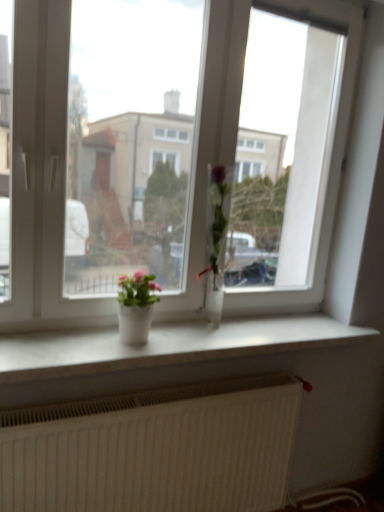
This screenshot has height=512, width=384. I want to click on white marble window sill at center, so click(166, 346).

Find the location of a particular element. This screenshot has width=384, height=512. clear glass vase at center, marked as the first houseplant in a right-to-left arrangement is located at coordinates (216, 239).

Find the location of `white textured radiator at lower center`. white textured radiator at lower center is located at coordinates (154, 449).

Considering the relative sizes of white textured radiator at lower center and white marble window sill at center in the image provided, is white textured radiator at lower center wider than white marble window sill at center?

In fact, white textured radiator at lower center might be narrower than white marble window sill at center.

Locate an element on the screen. Image resolution: width=384 pixels, height=512 pixels. radiator on the left of the white marble window sill at center is located at coordinates click(x=154, y=449).

Consider the image. Is white textured radiator at lower center taller or shorter than white marble window sill at center?

In the image, white textured radiator at lower center appears to be taller than white marble window sill at center.

Could you tell me if white textured radiator at lower center is facing white marble window sill at center?

No, white textured radiator at lower center does not turn towards white marble window sill at center.

Consider the image. From the image's perspective, is clear glass vase at center, marked as the first houseplant in a right-to-left arrangement, over white marble window sill at center?

Yes, from the image's perspective, clear glass vase at center, marked as the first houseplant in a right-to-left arrangement, is over white marble window sill at center.

Which is more distant, (213,222) or (262,331)?

The point (262,331) is more distant.

Can you confirm if clear glass vase at center, which is counted as the 2th houseplant, starting from the left, is wider than white marble window sill at center?

No, clear glass vase at center, which is counted as the 2th houseplant, starting from the left, is not wider than white marble window sill at center.

Is white textured radiator at lower center thinner than matte white pot at center, arranged as the first houseplant when viewed from the left?

Correct, the width of white textured radiator at lower center is less than that of matte white pot at center, arranged as the first houseplant when viewed from the left.

Which is closer to the camera, (71,443) or (142,275)?

Point (71,443) is closer to the camera than point (142,275).

How different are the orientations of white textured radiator at lower center and matte white pot at center, arranged as the first houseplant when viewed from the left, in degrees?

They differ by 2.68 degrees in their facing directions.

Looking at this image, from a real-world perspective, is white textured radiator at lower center located higher than matte white pot at center, arranged as the first houseplant when viewed from the left?

No.

Would you say transparent glass window at center is part of white marble window sill at center's contents?

Definitely not — transparent glass window at center is not inside white marble window sill at center.

Between white marble window sill at center and transparent glass window at center, which one has smaller size?

white marble window sill at center is smaller.

Can you confirm if white marble window sill at center is shorter than transparent glass window at center?

Yes, white marble window sill at center is shorter than transparent glass window at center.

Could matte white pot at center, which is the second houseplant in right-to-left order, be considered to be inside clear glass vase at center, marked as the first houseplant in a right-to-left arrangement?

No, matte white pot at center, which is the second houseplant in right-to-left order, is not inside clear glass vase at center, marked as the first houseplant in a right-to-left arrangement.

In terms of size, does clear glass vase at center, marked as the first houseplant in a right-to-left arrangement, appear bigger or smaller than matte white pot at center, arranged as the first houseplant when viewed from the left?

In the image, clear glass vase at center, marked as the first houseplant in a right-to-left arrangement, appears to be larger than matte white pot at center, arranged as the first houseplant when viewed from the left.

Which of these two, clear glass vase at center, which is counted as the 2th houseplant, starting from the left, or matte white pot at center, which is the second houseplant in right-to-left order, is thinner?

clear glass vase at center, which is counted as the 2th houseplant, starting from the left, is thinner.

Could you tell me if clear glass vase at center, which is counted as the 2th houseplant, starting from the left, is facing matte white pot at center, arranged as the first houseplant when viewed from the left?

No, clear glass vase at center, which is counted as the 2th houseplant, starting from the left, is not oriented towards matte white pot at center, arranged as the first houseplant when viewed from the left.

Is white marble window sill at center turned away from white textured radiator at lower center?

No, white marble window sill at center is not facing away from white textured radiator at lower center.

Considering the relative sizes of white marble window sill at center and white textured radiator at lower center in the image provided, is white marble window sill at center shorter than white textured radiator at lower center?

Correct, white marble window sill at center is not as tall as white textured radiator at lower center.

From the image's perspective, between white marble window sill at center and white textured radiator at lower center, who is located below?

white textured radiator at lower center appears lower in the image.

Is white marble window sill at center placed right next to white textured radiator at lower center?

They are not placed beside each other.

Does transparent glass window at center have a lesser width compared to clear glass vase at center, marked as the first houseplant in a right-to-left arrangement?

Yes.

Who is shorter, transparent glass window at center or clear glass vase at center, marked as the first houseplant in a right-to-left arrangement?

clear glass vase at center, marked as the first houseplant in a right-to-left arrangement.

From the image's perspective, which is above, transparent glass window at center or clear glass vase at center, which is counted as the 2th houseplant, starting from the left?

transparent glass window at center is shown above in the image.

At what (x,y) coordinates should I click in order to perform the action: click on radiator that appears below the white marble window sill at center (from the image's perspective). Please return your answer as a coordinate pair (x, y). Looking at the image, I should click on (154, 449).

There is a white marble window sill at center. At what (x,y) coordinates should I click in order to perform the action: click on the 2nd houseplant above it (from a real-world perspective). Please return your answer as a coordinate pair (x, y). Looking at the image, I should click on (216, 239).

Looking at the image, which one is located further to matte white pot at center, arranged as the first houseplant when viewed from the left, white textured radiator at lower center or white marble window sill at center?

Based on the image, white textured radiator at lower center appears to be further to matte white pot at center, arranged as the first houseplant when viewed from the left.

Which object lies nearer to the anchor point matte white pot at center, arranged as the first houseplant when viewed from the left, white textured radiator at lower center or transparent glass window at center?

transparent glass window at center is closer to matte white pot at center, arranged as the first houseplant when viewed from the left.

Which object lies further to the anchor point white textured radiator at lower center, clear glass vase at center, marked as the first houseplant in a right-to-left arrangement, or white marble window sill at center?

The object further to white textured radiator at lower center is clear glass vase at center, marked as the first houseplant in a right-to-left arrangement.

Based on their spatial positions, is transparent glass window at center or clear glass vase at center, marked as the first houseplant in a right-to-left arrangement, further from white textured radiator at lower center?

transparent glass window at center is further to white textured radiator at lower center.

Considering their positions, is white textured radiator at lower center positioned further to clear glass vase at center, marked as the first houseplant in a right-to-left arrangement, than matte white pot at center, which is the second houseplant in right-to-left order?

Among the two, white textured radiator at lower center is located further to clear glass vase at center, marked as the first houseplant in a right-to-left arrangement.

From the image, which object appears to be nearer to white marble window sill at center, matte white pot at center, which is the second houseplant in right-to-left order, or transparent glass window at center?

matte white pot at center, which is the second houseplant in right-to-left order.

Based on their spatial positions, is matte white pot at center, which is the second houseplant in right-to-left order, or clear glass vase at center, marked as the first houseplant in a right-to-left arrangement, further from transparent glass window at center?

The object further to transparent glass window at center is matte white pot at center, which is the second houseplant in right-to-left order.

From the image, which object appears to be nearer to white marble window sill at center, clear glass vase at center, which is counted as the 2th houseplant, starting from the left, or white textured radiator at lower center?

white textured radiator at lower center lies closer to white marble window sill at center than the other object.

Where is `houseplant that lies between clear glass vase at center, marked as the first houseplant in a right-to-left arrangement, and white marble window sill at center from top to bottom`? houseplant that lies between clear glass vase at center, marked as the first houseplant in a right-to-left arrangement, and white marble window sill at center from top to bottom is located at coordinates (136, 306).

I want to click on window sill between transparent glass window at center and white textured radiator at lower center in the up-down direction, so click(x=166, y=346).

You are a GUI agent. You are given a task and a screenshot of the screen. Output one action in this format:
    pyautogui.click(x=<x>, y=<y>)
    Task: Click on the window sill between matte white pot at center, arranged as the first houseplant when viewed from the left, and white textured radiator at lower center in the up-down direction
    This screenshot has height=512, width=384.
    Given the screenshot: What is the action you would take?
    pyautogui.click(x=166, y=346)

You are a GUI agent. You are given a task and a screenshot of the screen. Output one action in this format:
    pyautogui.click(x=<x>, y=<y>)
    Task: Click on the window sill between clear glass vase at center, marked as the first houseplant in a right-to-left arrangement, and white textured radiator at lower center from top to bottom
    The height and width of the screenshot is (512, 384).
    Given the screenshot: What is the action you would take?
    pyautogui.click(x=166, y=346)